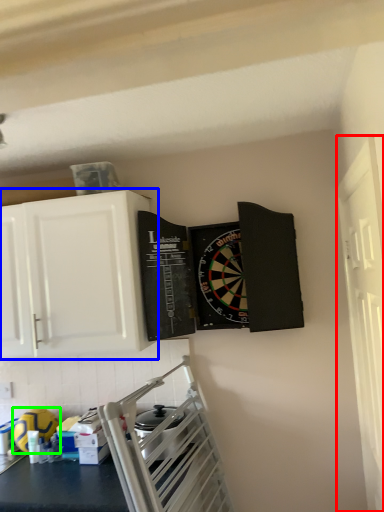
Question: Considering the real-world distances, which object is closest to window (highlighted by a red box)? cabinetry (highlighted by a blue box) or appliance (highlighted by a green box).

Choices:
 (A) cabinetry
 (B) appliance

Answer: (A)